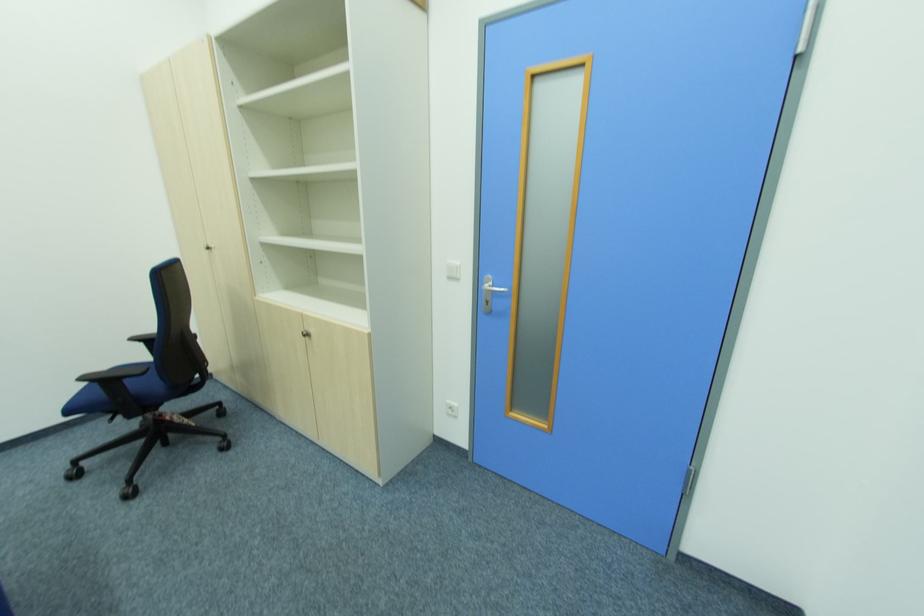
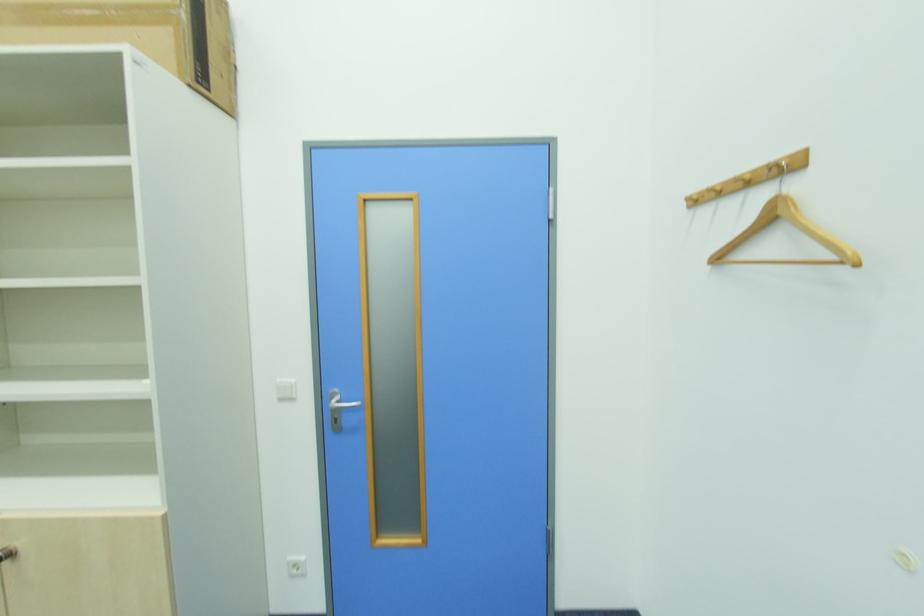
Question: The images are taken continuously from a first-person perspective. In which direction is your viewpoint rotating?

Choices:
 (A) Left
 (B) Right
 (C) Up
 (D) Down

Answer: (B)